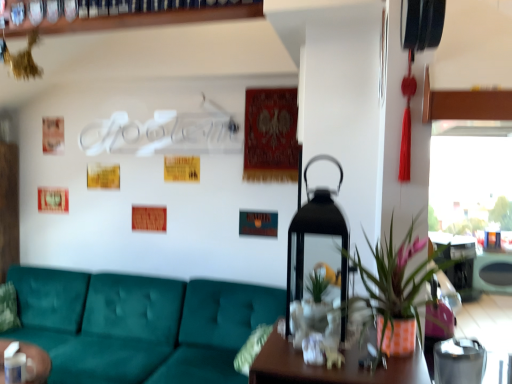
The image size is (512, 384). In order to click on transparent glass window at upper right in this screenshot , I will do `click(472, 180)`.

In order to face teal fabric couch at lower left, should I rotate leftwards or rightwards?

You should look left and rotate roughly 22.904 degrees.

You are a GUI agent. You are given a task and a screenshot of the screen. Output one action in this format:
    pyautogui.click(x=<x>, y=<y>)
    Task: Click on the orange textured pot at center
    This screenshot has height=384, width=512.
    Given the screenshot: What is the action you would take?
    pyautogui.click(x=396, y=281)

Which is more to the right, transparent glass window at upper right or orange textured pot at center?

From the viewer's perspective, transparent glass window at upper right appears more on the right side.

Which object is wider, transparent glass window at upper right or orange textured pot at center?

orange textured pot at center.

Is orange textured pot at center at the back of transparent glass window at upper right?

transparent glass window at upper right is not turned away from orange textured pot at center.

Does point (448, 276) appear closer or farther from the camera than point (424, 266)?

Point (448, 276).

Is wooden table at right further to camera compared to orange textured pot at center?

Yes, it is.

From the image's perspective, is wooden table at right located beneath orange textured pot at center?

Yes, from the image's perspective, wooden table at right is beneath orange textured pot at center.

How distant is wooden table at right from orange textured pot at center?

wooden table at right is 1.32 meters from orange textured pot at center.

Which object is positioned more to the left, orange textured pot at center or wooden table at right?

Positioned to the left is orange textured pot at center.

From a real-world perspective, does orange textured pot at center sit lower than wooden table at right?

Incorrect, from a real-world perspective, orange textured pot at center is higher than wooden table at right.

Considering their positions, is orange textured pot at center located in front of or behind wooden table at right?

Visually, orange textured pot at center is located in front of wooden table at right.

From the image's perspective, which one is positioned lower, orange textured pot at center or wooden table at right?

wooden table at right is shown below in the image.

Is teal fabric couch at lower left positioned far away from transparent glass window at upper right?

Yes, teal fabric couch at lower left and transparent glass window at upper right are quite far apart.

From the image's perspective, relative to transparent glass window at upper right, is teal fabric couch at lower left above or below?

Based on their image positions, teal fabric couch at lower left is located beneath transparent glass window at upper right.

How distant is teal fabric couch at lower left from transparent glass window at upper right?

teal fabric couch at lower left is 5.73 feet away from transparent glass window at upper right.

This screenshot has width=512, height=384. What are the coordinates of `studio couch on the left of transparent glass window at upper right` in the screenshot? It's located at (143, 326).

From the image's perspective, who appears lower, wooden table at right or transparent glass window at upper right?

wooden table at right, from the image's perspective.

Which of these two, wooden table at right or transparent glass window at upper right, is wider?

wooden table at right is wider.

Is wooden table at right positioned beyond the bounds of transparent glass window at upper right?

wooden table at right lies outside transparent glass window at upper right's area.

Looking at this image, does wooden table at right have a larger size compared to transparent glass window at upper right?

Actually, wooden table at right might be smaller than transparent glass window at upper right.

Can you tell me how much orange textured pot at center and transparent glass window at upper right differ in facing direction?

The angular difference between orange textured pot at center and transparent glass window at upper right is 0.638 degrees.

In the image, is orange textured pot at center positioned in front of or behind transparent glass window at upper right?

Clearly, orange textured pot at center is in front of transparent glass window at upper right.

Does orange textured pot at center appear on the right side of transparent glass window at upper right?

No, orange textured pot at center is not to the right of transparent glass window at upper right.

Visually, is wooden table at right positioned to the left or to the right of teal fabric couch at lower left?

wooden table at right is to the right of teal fabric couch at lower left.

Is wooden table at right wider than teal fabric couch at lower left?

In fact, wooden table at right might be narrower than teal fabric couch at lower left.

Is wooden table at right with teal fabric couch at lower left?

No, wooden table at right is not touching teal fabric couch at lower left.

Where is `window screen on the right side of orange textured pot at center`? The width and height of the screenshot is (512, 384). window screen on the right side of orange textured pot at center is located at coordinates (472, 180).

Locate an element on the screen. The height and width of the screenshot is (384, 512). table that appears below the orange textured pot at center (from the image's perspective) is located at coordinates (457, 262).

Considering their positions, is orange textured pot at center positioned closer to teal fabric couch at lower left than transparent glass window at upper right?

orange textured pot at center.

Which object lies further to the anchor point transparent glass window at upper right, orange textured pot at center or teal fabric couch at lower left?

The object further to transparent glass window at upper right is teal fabric couch at lower left.

Considering their positions, is transparent glass window at upper right positioned further to teal fabric couch at lower left than orange textured pot at center?

transparent glass window at upper right lies further to teal fabric couch at lower left than the other object.

Estimate the real-world distances between objects in this image. Which object is further from orange textured pot at center, teal fabric couch at lower left or wooden table at right?

teal fabric couch at lower left lies further to orange textured pot at center than the other object.

Considering their positions, is transparent glass window at upper right positioned closer to wooden table at right than teal fabric couch at lower left?

transparent glass window at upper right is closer to wooden table at right.

Based on their spatial positions, is orange textured pot at center or wooden table at right further from teal fabric couch at lower left?

Among the two, wooden table at right is located further to teal fabric couch at lower left.

When comparing their distances from transparent glass window at upper right, does orange textured pot at center or wooden table at right seem further?

The object further to transparent glass window at upper right is orange textured pot at center.

Based on their spatial positions, is transparent glass window at upper right or orange textured pot at center closer to wooden table at right?

transparent glass window at upper right is positioned closer to the anchor wooden table at right.

At what (x,y) coordinates should I click in order to perform the action: click on table located between orange textured pot at center and transparent glass window at upper right in the depth direction. Please return your answer as a coordinate pair (x, y). Image resolution: width=512 pixels, height=384 pixels. Looking at the image, I should click on (457, 262).

Image resolution: width=512 pixels, height=384 pixels. What are the coordinates of `houseplant located between teal fabric couch at lower left and transparent glass window at upper right in the left-right direction` in the screenshot? It's located at click(x=396, y=281).

This screenshot has width=512, height=384. In order to click on table between teal fabric couch at lower left and transparent glass window at upper right from left to right in this screenshot , I will do `click(457, 262)`.

Where is `houseplant located between teal fabric couch at lower left and wooden table at right in the left-right direction`? The image size is (512, 384). houseplant located between teal fabric couch at lower left and wooden table at right in the left-right direction is located at coordinates (396, 281).